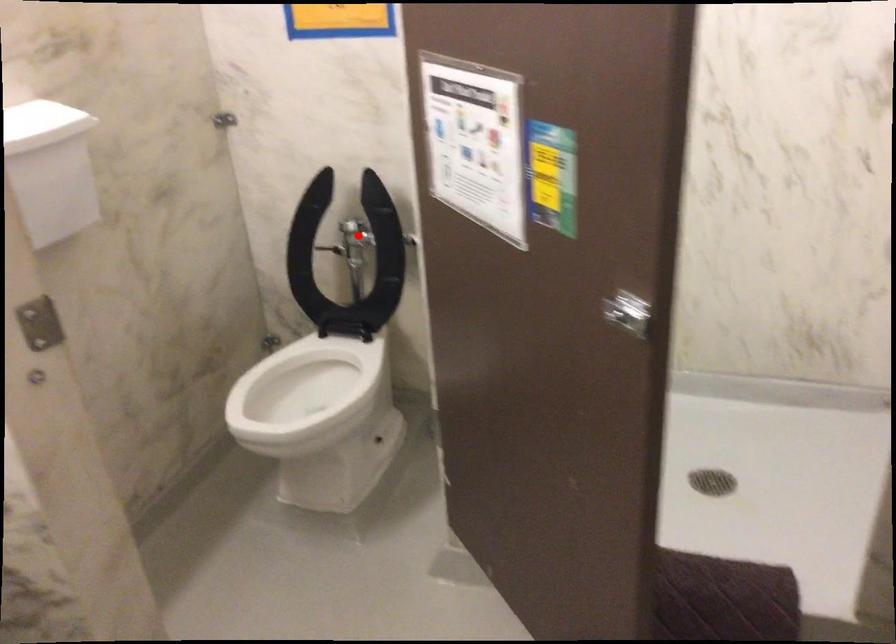
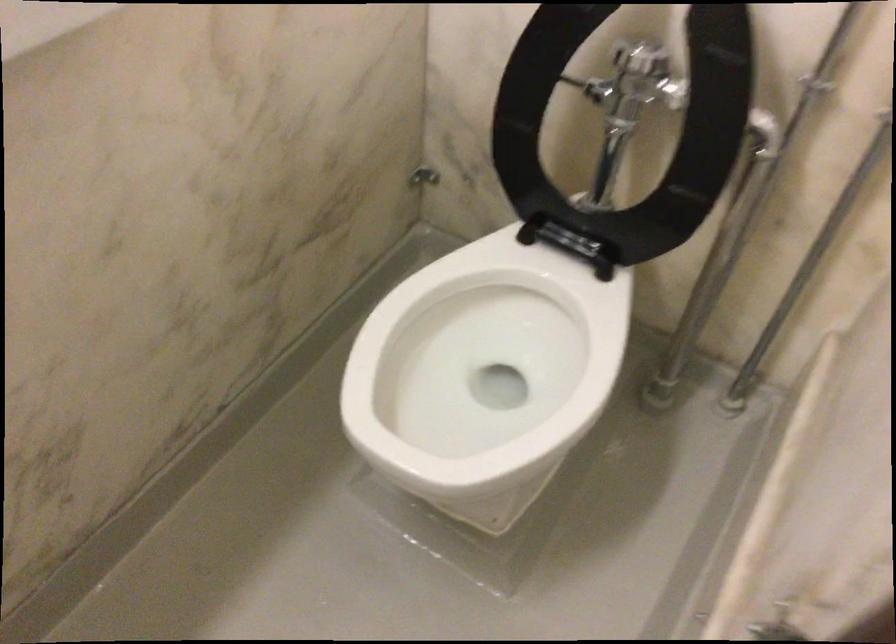
Find the pixel in the second image that matches the highlighted location in the first image.

(633, 82)